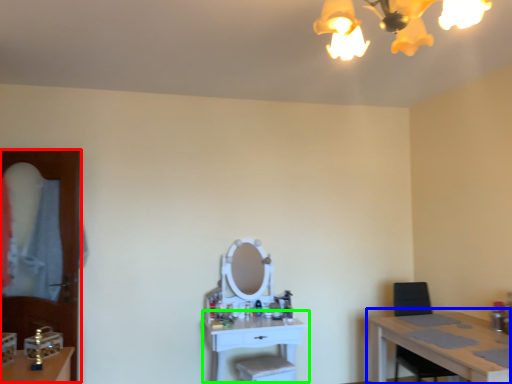
Question: Which object is the closest to the glass door (highlighted by a red box)? Choose among these: table (highlighted by a blue box) or table (highlighted by a green box).

Choices:
 (A) table
 (B) table

Answer: (B)